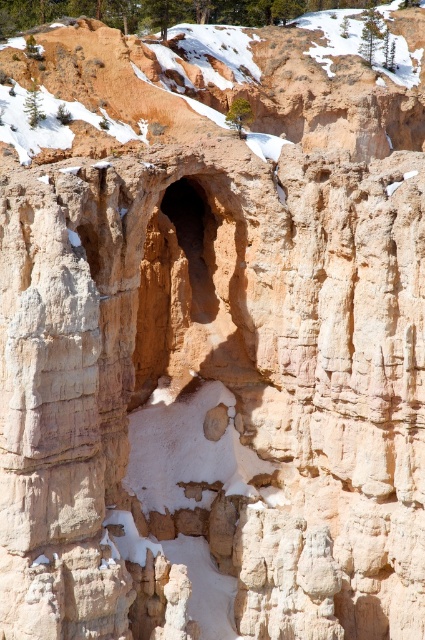
Does point (130, 54) lie in front of point (204, 310)?

No, it is not.

Does smooth sandstone canyon at center come in front of rustic sandstone cave at center?

No.

This screenshot has width=425, height=640. Describe the element at coordinates (221, 76) in the screenshot. I see `smooth sandstone canyon at center` at that location.

Identify the location of smooth sandstone canyon at center. This screenshot has height=640, width=425. (221, 76).